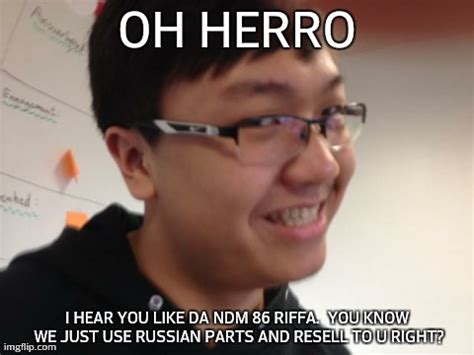
This screenshot has height=355, width=474. I want to click on wall, so click(x=410, y=205).